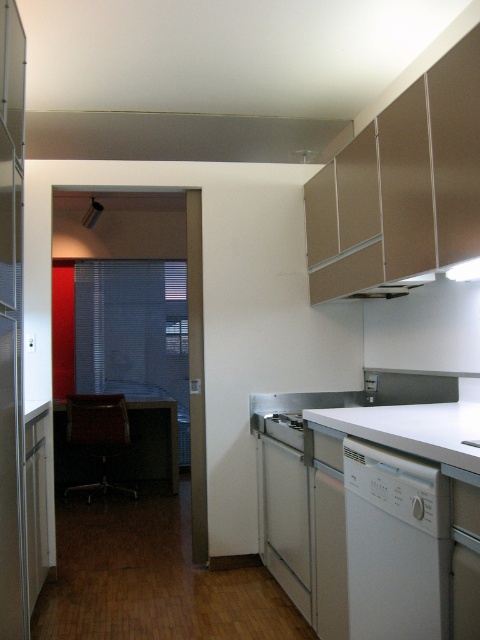
You are a delivery person holding a new dishwasher that is 1.6 meters wide. You need to deliver it to the kitchen shown in the image. Can you fit the new dishwasher through the doorway without removing any existing items? The existing dishwasher is the white matte dishwasher at lower right.

The distance between the white matte dishwasher at lower right and the camera is 1.57 meters. Since the new dishwasher is 1.6 meters wide, it is slightly wider than the available space. Therefore, it might not fit through the doorway without adjustments or removal of existing items.

You are a chef preparing to place a large pot on the counter near the stove. The pot has a diameter of 22 inches. Given the space between the white matte countertop at lower right and the white glossy stove at lower center, will the pot fit without touching either surface?

The distance between the white matte countertop at lower right and the white glossy stove at lower center is 24.77 inches. Since the pot has a diameter of 22 inches, it will fit within the space as there is enough room between the two surfaces to accommodate it without touching either.

You are standing in the modern kitchen described and want to place a small plant between the two points, point [447,481] and point [432,426]. Which point should the plant be closer to in order to be nearer to the viewer?

The plant should be closer to point [447,481] because it is closer to the viewer than point [432,426].